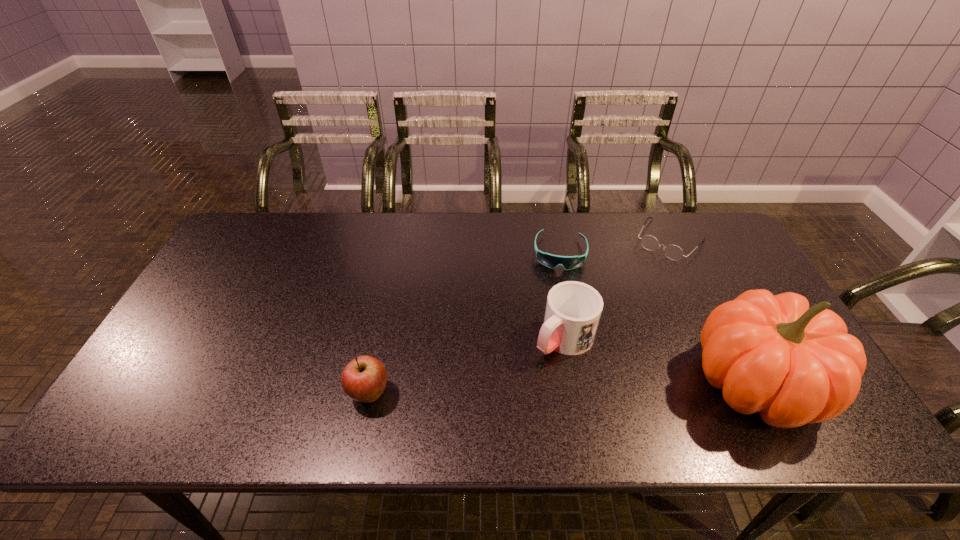
Identify the location of free space on the desktop that is between the leftmost object and the pumpkin and is positioned through the lenses of the spectacles. (564, 388).

Where is `vacant space on the desktop that is between the apple and the tallest object and is positioned on the front-facing side of the sunglasses`? The width and height of the screenshot is (960, 540). vacant space on the desktop that is between the apple and the tallest object and is positioned on the front-facing side of the sunglasses is located at coordinates (555, 388).

Identify the location of free space on the desktop that is between the leftmost object and the pumpkin and is positioned on the side of the mug with the handle. The height and width of the screenshot is (540, 960). (507, 389).